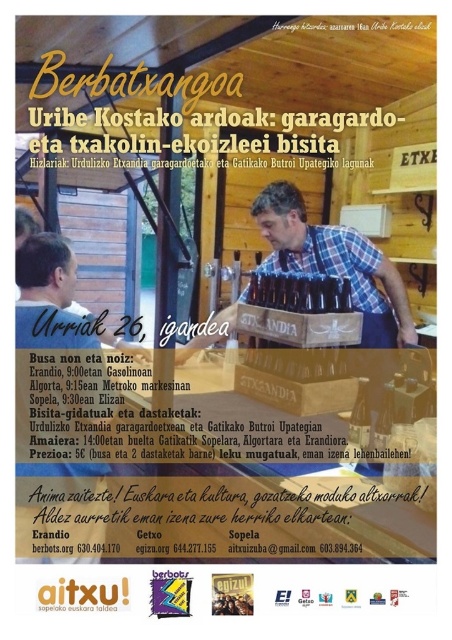
You are organizing a display for the Berbatxangoa event and need to place the brown wooden crate at center and the translucent glass bottle at center on a shelf. Which object will you place at the bottom to ensure stability?

The brown wooden crate at center should be placed at the bottom because it has a greater height than the translucent glass bottle at center, providing a stable base.

You are an event attendee at the Berbatxangoa poster. You want to take a photo of the translucent glass bottle at center without the plaid shirt at center blocking it. How can you adjust your position to achieve this?

The translucent glass bottle at center is behind the plaid shirt at center, so you can move to the side to get an unobstructed view of the bottle.

You are an event attendee at the Berbatxangoa poster. You notice the brown wooden crate at center and the plaid shirt at center. Which object is closer to you?

The brown wooden crate at center is closer to you because the plaid shirt at center is behind it.